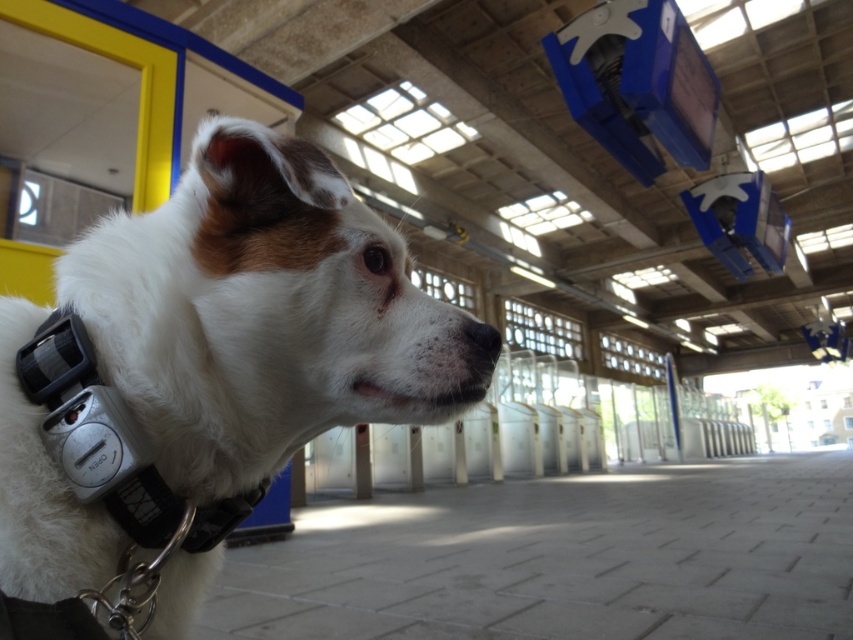
Question: Which point is farther to the camera?

Choices:
 (A) click(135, 424)
 (B) click(73, 611)

Answer: (A)

Question: Which object is closer to the camera taking this photo?

Choices:
 (A) white fur dog at center
 (B) silver/black plastic neckband at left

Answer: (A)

Question: Which object is farther from the camera taking this photo?

Choices:
 (A) silver/black plastic neckband at left
 (B) white fur dog at center

Answer: (A)

Question: Can you confirm if white fur dog at center is positioned above silver/black plastic neckband at left?

Choices:
 (A) no
 (B) yes

Answer: (B)

Question: Does white fur dog at center appear under silver/black plastic neckband at left?

Choices:
 (A) yes
 (B) no

Answer: (B)

Question: Is white fur dog at center thinner than silver/black plastic neckband at left?

Choices:
 (A) yes
 (B) no

Answer: (B)